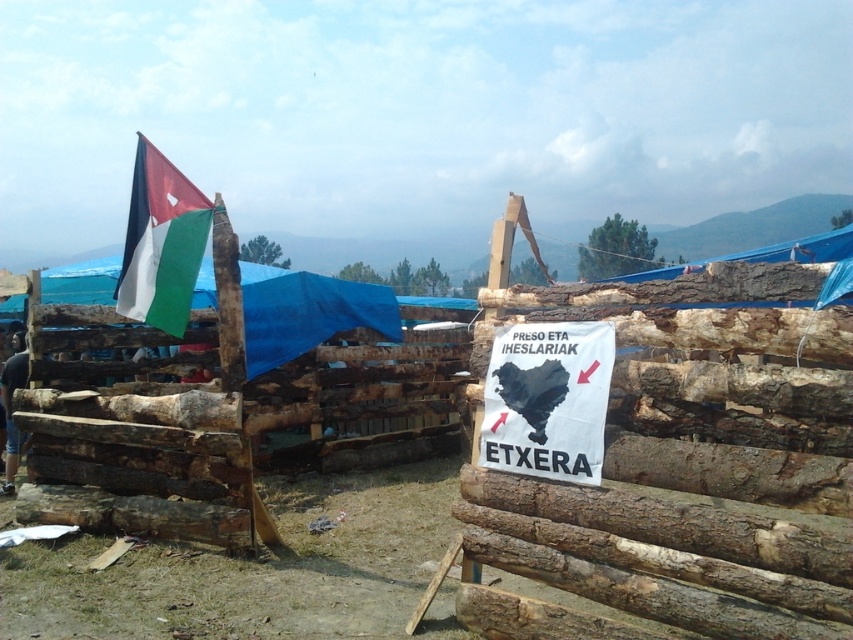
You are a photographer setting up a tripod to capture the Palestinian flag and the Basque sign in the scene. You notice the matte fabric flag at upper left and the dark blue jeans at left. Which object should you focus on first if you want to ensure both are in frame without moving the tripod?

The matte fabric flag at upper left is located above the dark blue jeans at left, so focusing on the flag first will ensure the jeans remain in the lower part of the frame without needing to adjust the tripod.

You are an observer standing in front of the structure. There is a point marked at coordinates (161,243). What object is located at that point?

The point at coordinates (161,243) corresponds to the matte fabric flag at upper left.

You are a photographer standing in front of the structure. You want to take a photo that includes both the matte fabric flag at upper left and the dark blue jeans at left. Which object should you focus on first to ensure both are in sharp focus?

You should focus on the matte fabric flag at upper left first because it is closer to the viewer than the dark blue jeans at left, so adjusting focus from near to far will help both be in focus.